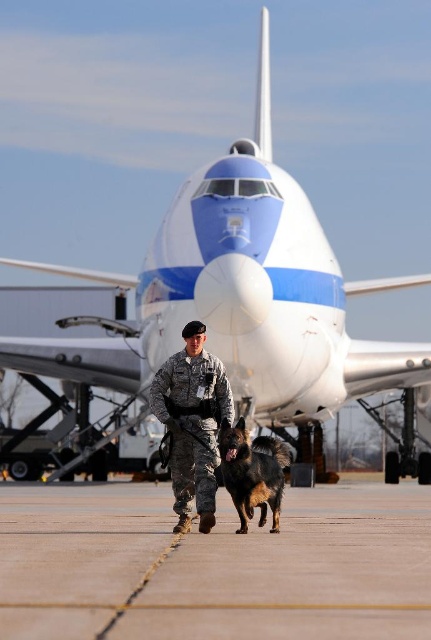
You are a photographer standing at the edge of the airfield. You want to take a picture of the camouflage uniform at center and the concrete tarmac at center. Which object is positioned lower in the frame?

The concrete tarmac at center is located below camouflage uniform at center, so the concrete tarmac at center is positioned lower in the frame.

Consider the image. You are a photographer at the airfield. You want to capture a clear photo of the black fur dog at center without the camouflage uniform at center blocking it. Is this possible based on their positions?

The camouflage uniform at center is positioned over the black fur dog at center, so it will block the view of the dog. To capture a clear photo of the black fur dog at center, you would need to adjust your angle or position to avoid the camouflage uniform at center.

You are a photographer standing at the edge of the airfield. You want to take a photo that includes both the concrete tarmac at center and the camouflage uniform at center. Which object should you focus on first to ensure both are in sharp focus?

The concrete tarmac at center is closer to the viewer than the camouflage uniform at center. To ensure both are in sharp focus, you should focus on the concrete tarmac at center since it is closer, and the camouflage uniform at center will fall within the depth of field if properly adjusted.